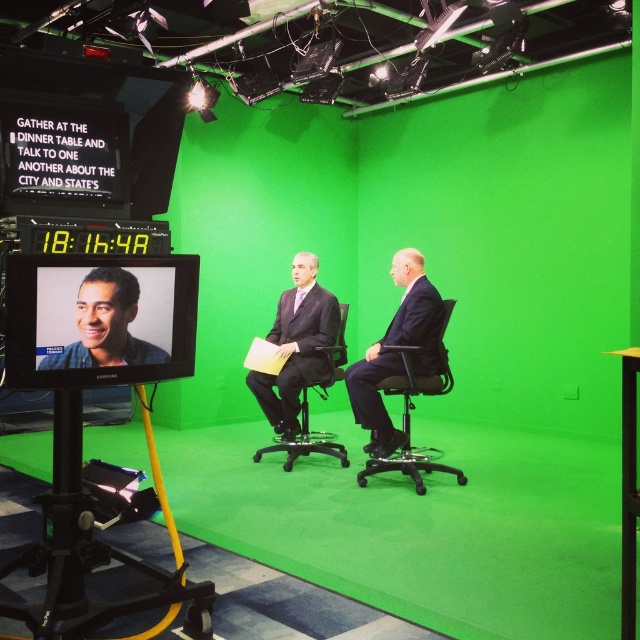
At what (x,y) coordinates should I click in order to perform the action: click on matte black suit at center. Please return your answer as a coordinate pair (x, y). Looking at the image, I should click on (298, 346).

Is matte black suit at center above black plastic chair at right?

Yes, matte black suit at center is above black plastic chair at right.

Where is `matte black suit at center`? matte black suit at center is located at coordinates 298,346.

What are the coordinates of `matte black suit at center` in the screenshot? It's located at (298, 346).

Is the position of dark suit at center less distant than that of black plastic chair at right?

No, dark suit at center is behind black plastic chair at right.

Does dark suit at center have a lesser width compared to black plastic chair at right?

Yes.

Where is `dark suit at center`? The height and width of the screenshot is (640, 640). dark suit at center is located at coordinates (396, 353).

The width and height of the screenshot is (640, 640). In order to click on dark suit at center in this screenshot , I will do `click(396, 353)`.

Is point (396, 316) positioned before point (68, 349)?

No, it is behind (68, 349).

What do you see at coordinates (396, 353) in the screenshot? I see `dark suit at center` at bounding box center [396, 353].

Between point (428, 369) and point (96, 316), which one is positioned in front?

Point (96, 316) is in front.

The height and width of the screenshot is (640, 640). I want to click on dark suit at center, so click(x=396, y=353).